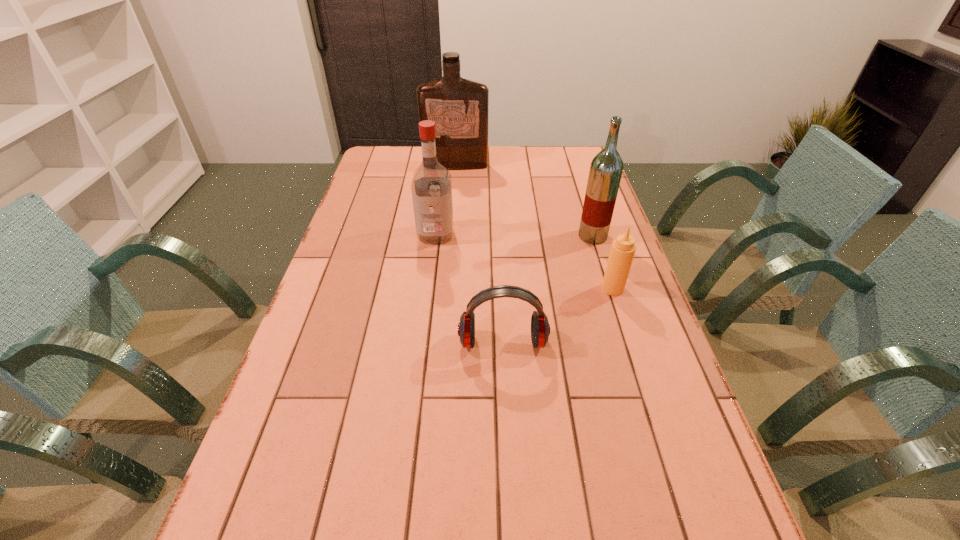
At what (x,y) coordinates should I click in order to perform the action: click on liquor that stands as the closest to the rightmost liquor. Please return your answer as a coordinate pair (x, y). The image size is (960, 540). Looking at the image, I should click on (431, 187).

Choose which liquor is the nearest neighbor to the farthest object. Please provide its 2D coordinates. Your answer should be formatted as a tuple, i.e. [(x, y)], where the tuple contains the x and y coordinates of a point satisfying the conditions above.

[(431, 187)]